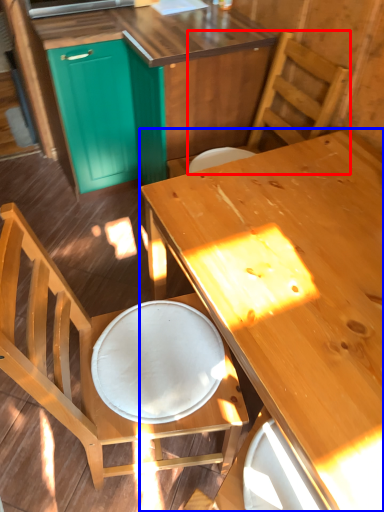
Question: Which point is further to the camera, chair (highlighted by a red box) or desk (highlighted by a blue box)?

Choices:
 (A) chair
 (B) desk

Answer: (A)